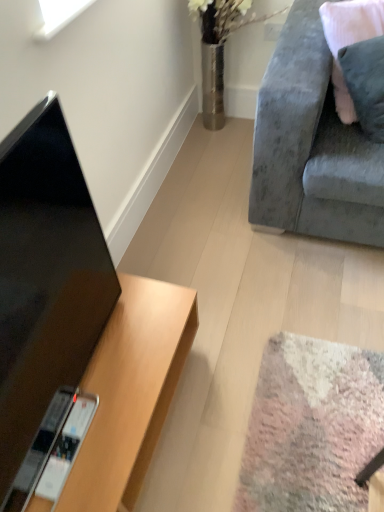
Find the location of `vacant region under black glossy tv at left (from a real-world perspective)`. vacant region under black glossy tv at left (from a real-world perspective) is located at coordinates (86, 367).